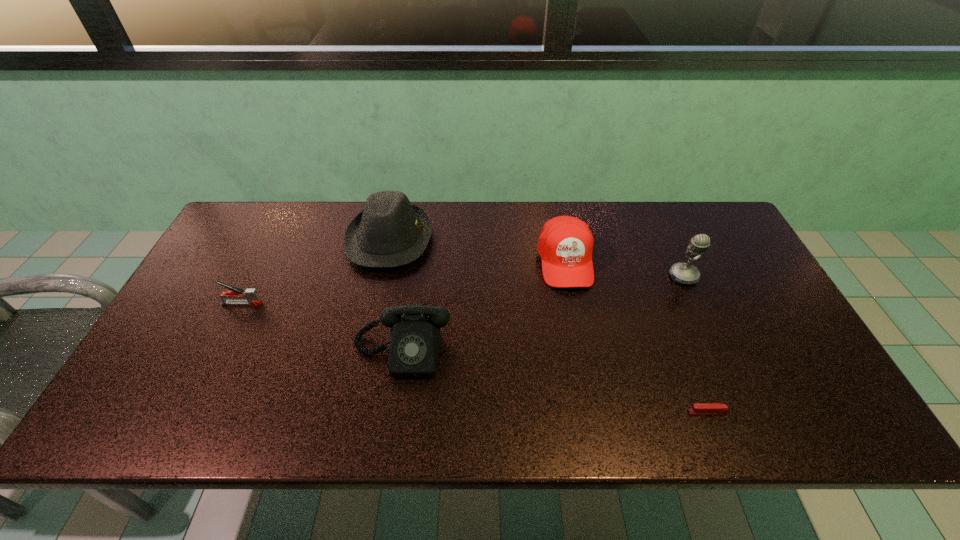
Find the location of `vacant space at the far edge of the desktop`. vacant space at the far edge of the desktop is located at coordinates (328, 233).

The width and height of the screenshot is (960, 540). In the image, there is a desktop. Find the location of `blank space at the near edge`. blank space at the near edge is located at coordinates (704, 403).

Image resolution: width=960 pixels, height=540 pixels. I want to click on free space at the left edge, so click(204, 330).

Identify the location of vacant region between the third object from right to left and the telephone. This screenshot has height=540, width=960. (x=484, y=307).

Locate an element on the screen. free space between the nearest object and the baseball cap is located at coordinates (636, 337).

At what (x,y) coordinates should I click in order to perform the action: click on free point between the shortest object and the tallest object. Please return your answer as a coordinate pair (x, y). Looking at the image, I should click on (695, 345).

Identify the location of vacant area that lies between the fourth object from left to right and the third nearest object. (403, 282).

Where is `free spot between the fedora and the leftmost object`? This screenshot has width=960, height=540. free spot between the fedora and the leftmost object is located at coordinates (316, 271).

Identify the location of free space that is in between the tallest object and the fourth object from left to right. (624, 269).

I want to click on vacant area between the tallest object and the fourth object from left to right, so click(624, 269).